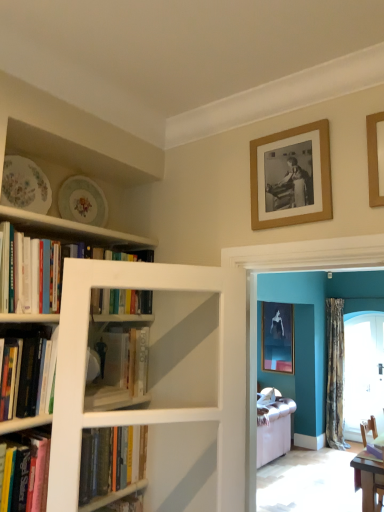
Question: Is hardcover book at center, acting as the 3th book starting from the bottom, closer to camera compared to clear glass door at right?

Choices:
 (A) yes
 (B) no

Answer: (A)

Question: Is hardcover book at center, acting as the 3th book starting from the bottom, shorter than clear glass door at right?

Choices:
 (A) yes
 (B) no

Answer: (A)

Question: Is hardcover book at center, acting as the 3th book starting from the bottom, at the right side of clear glass door at right?

Choices:
 (A) no
 (B) yes

Answer: (A)

Question: From a real-world perspective, is hardcover book at center, the 3th book viewed from the top, beneath clear glass door at right?

Choices:
 (A) yes
 (B) no

Answer: (B)

Question: From the image's perspective, is hardcover book at center, acting as the 3th book starting from the bottom, on clear glass door at right?

Choices:
 (A) yes
 (B) no

Answer: (A)

Question: Is hardcover book at center, the 3th book viewed from the top, facing away from clear glass door at right?

Choices:
 (A) yes
 (B) no

Answer: (B)

Question: Is wooden picture frame at upper right, the 1th picture frame viewed from the top, looking in the opposite direction of hardcover book at left, which appears as the fourth book when ordered from the bottom?

Choices:
 (A) no
 (B) yes

Answer: (A)

Question: Is wooden picture frame at upper right, the 1th picture frame viewed from the top, far away from hardcover book at left, which is the second book from top to bottom?

Choices:
 (A) no
 (B) yes

Answer: (B)

Question: Can you confirm if wooden picture frame at upper right, the 1th picture frame viewed from the top, is thinner than hardcover book at left, which appears as the fourth book when ordered from the bottom?

Choices:
 (A) yes
 (B) no

Answer: (A)

Question: Considering the relative sizes of wooden picture frame at upper right, marked as the 3th picture frame in a bottom-to-top arrangement, and hardcover book at left, which is the second book from top to bottom, in the image provided, is wooden picture frame at upper right, marked as the 3th picture frame in a bottom-to-top arrangement, bigger than hardcover book at left, which is the second book from top to bottom,?

Choices:
 (A) yes
 (B) no

Answer: (B)

Question: Can you confirm if wooden picture frame at upper right, the 1th picture frame viewed from the top, is wider than hardcover book at left, which is the second book from top to bottom?

Choices:
 (A) no
 (B) yes

Answer: (A)

Question: Does wooden picture frame at upper right, positioned as the 2th picture frame in left-to-right order, appear on the left side of hardcover book at left, which is the second book from top to bottom?

Choices:
 (A) no
 (B) yes

Answer: (A)

Question: Considering the relative positions of porcelain floral plate at upper left, which is the first plate in back-to-front order, and wooden picture frame at upper right, arranged as the 1th picture frame when viewed from the front, in the image provided, is porcelain floral plate at upper left, which is the first plate in back-to-front order, to the left of wooden picture frame at upper right, arranged as the 1th picture frame when viewed from the front, from the viewer's perspective?

Choices:
 (A) yes
 (B) no

Answer: (A)